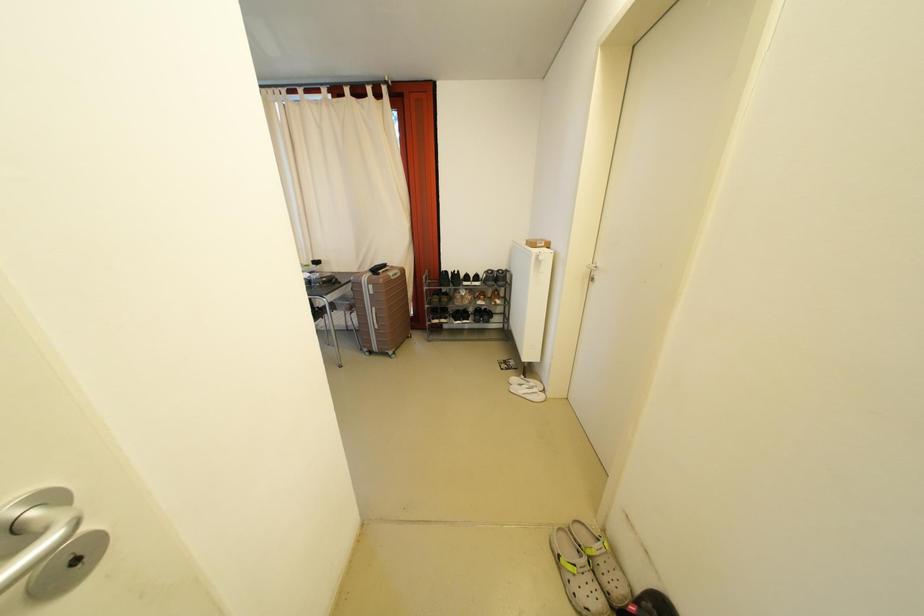
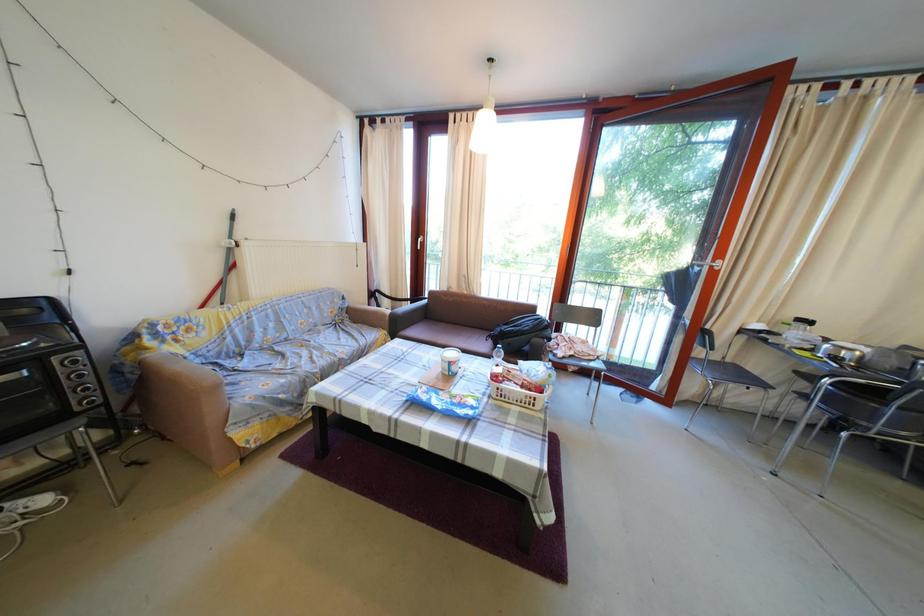
Question: Which direction would the cameraman need to move to produce the second image? Reply with the corresponding letter.

Choices:
 (A) Left
 (B) Right
 (C) Forward
 (D) Backward

Answer: (A)